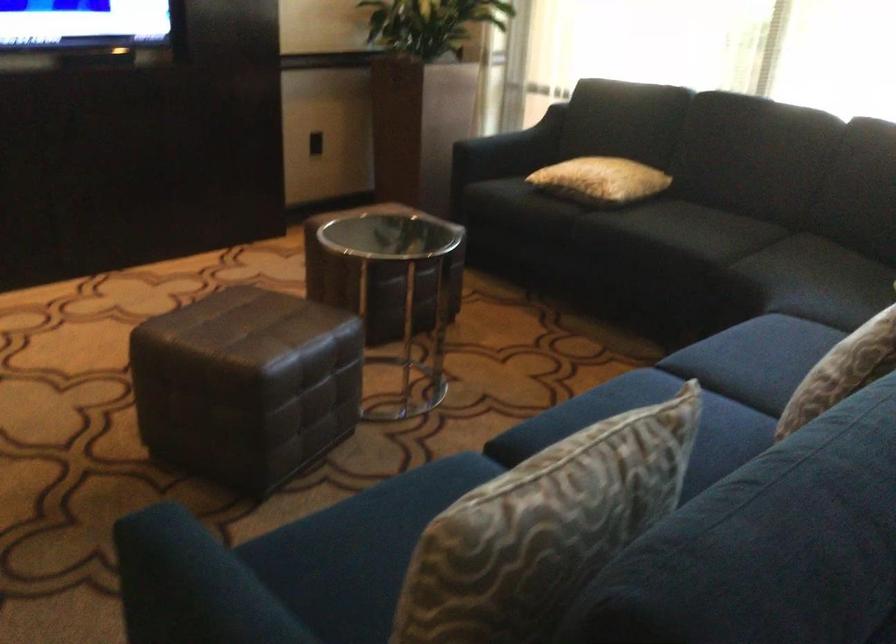
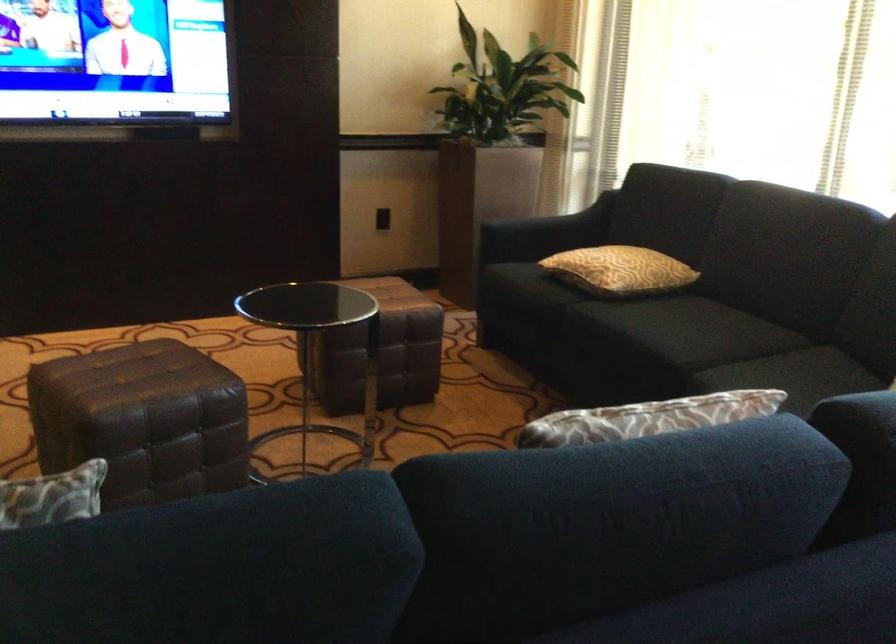
Question: The first image is from the beginning of the video and the second image is from the end. How did the camera likely rotate when shooting the video?

Choices:
 (A) Left
 (B) Right
 (C) Up
 (D) Down

Answer: (A)